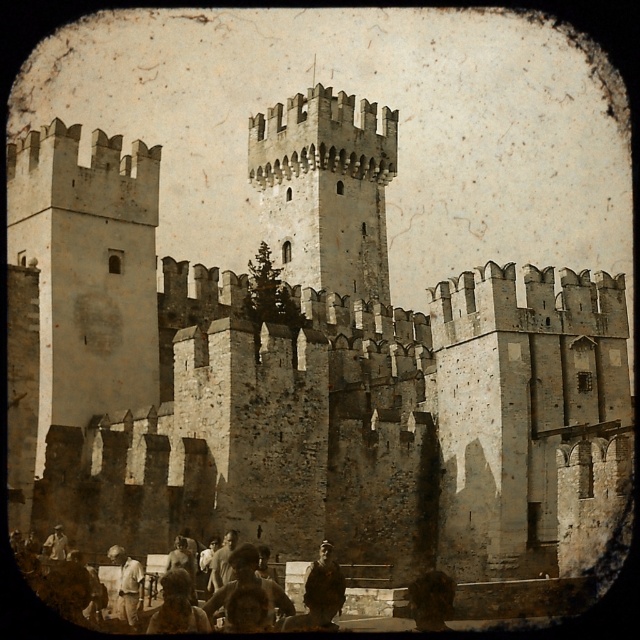
You are a tour guide standing at the viewing platform of the historic stone castle. You notice two items at lower center in your viewfinder. Which item is positioned higher between the brown textured hair at lower center and the light brown leather jacket at lower center?

The brown textured hair at lower center is taller than the light brown leather jacket at lower center, so the brown textured hair at lower center is positioned higher.

You are standing at the viewing platform near the castle walls. You notice two points marked on the castle structure. The first point is at coordinates point (x=323, y=563) and the second is at point (x=140, y=584). Which point is closer to your current position?

Point (x=323, y=563) is closer to the camera than point (x=140, y=584), so the first point is closer to your current position.

You are a tour guide at the castle and notice two visitors wearing leather jackets. One is wearing a dark brown leather jacket at center and the other a light brown leather jacket at lower left. Since the castle has a strict size limit for jackets due to narrow doorways, which visitor might have difficulty passing through the narrowest doorway?

The dark brown leather jacket at center has a larger size compared to the light brown leather jacket at lower left, so the visitor wearing the dark brown leather jacket at center might have difficulty passing through the narrowest doorway due to its larger size.